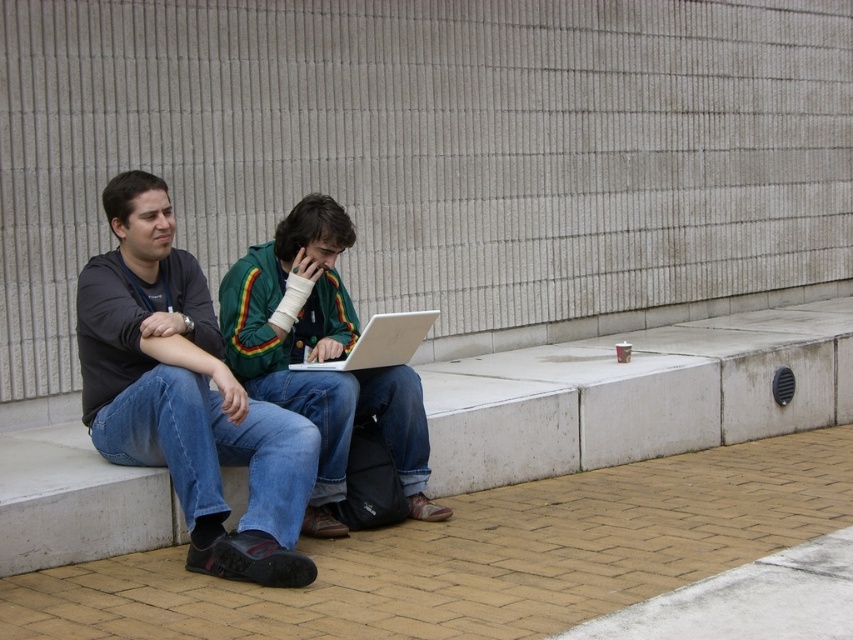
Who is shorter, white concrete ledge at center or silver metallic laptop at center?

silver metallic laptop at center

Is white concrete ledge at center smaller than silver metallic laptop at center?

Yes, white concrete ledge at center is smaller than silver metallic laptop at center.

Image resolution: width=853 pixels, height=640 pixels. In order to click on white concrete ledge at center in this screenshot , I will do `click(634, 396)`.

Where is `white concrete ledge at center`? The image size is (853, 640). white concrete ledge at center is located at coordinates [634, 396].

Where is `white concrete ledge at center`? white concrete ledge at center is located at coordinates (634, 396).

Is white concrete ledge at center smaller than dark gray fabric shirt at center?

Yes.

You are a GUI agent. You are given a task and a screenshot of the screen. Output one action in this format:
    pyautogui.click(x=<x>, y=<y>)
    Task: Click on the white concrete ledge at center
    The width and height of the screenshot is (853, 640).
    Given the screenshot: What is the action you would take?
    pyautogui.click(x=634, y=396)

Is white concrete ledge at center above green textured jacket at center?

Actually, white concrete ledge at center is below green textured jacket at center.

Which is more to the right, white concrete ledge at center or green textured jacket at center?

Positioned to the right is white concrete ledge at center.

I want to click on white concrete ledge at center, so click(634, 396).